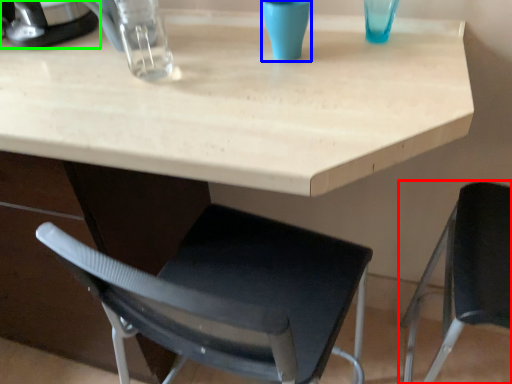
Question: Estimate the real-world distances between objects in this image. Which object is farther from chair (highlighted by a red box), clear (highlighted by a blue box) or appliance (highlighted by a green box)?

Choices:
 (A) clear
 (B) appliance

Answer: (B)